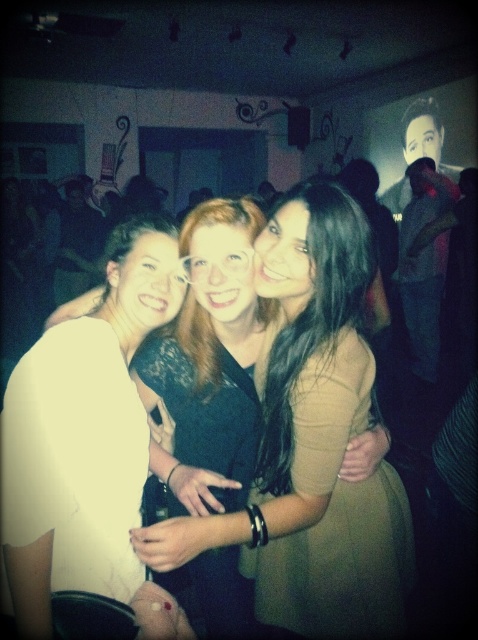
Question: Observing the image, what is the correct spatial positioning of white matte shirt at center in reference to matte black dress at center?

Choices:
 (A) below
 (B) above

Answer: (B)

Question: Among these objects, which one is nearest to the camera?

Choices:
 (A) matte black dress at center
 (B) white matte shirt at center

Answer: (B)

Question: Does white matte shirt at center have a smaller size compared to matte black dress at center?

Choices:
 (A) no
 (B) yes

Answer: (B)

Question: Among these objects, which one is nearest to the camera?

Choices:
 (A) matte black dress at center
 (B) white matte shirt at center

Answer: (B)

Question: Does white matte shirt at center come in front of matte black dress at center?

Choices:
 (A) no
 (B) yes

Answer: (B)